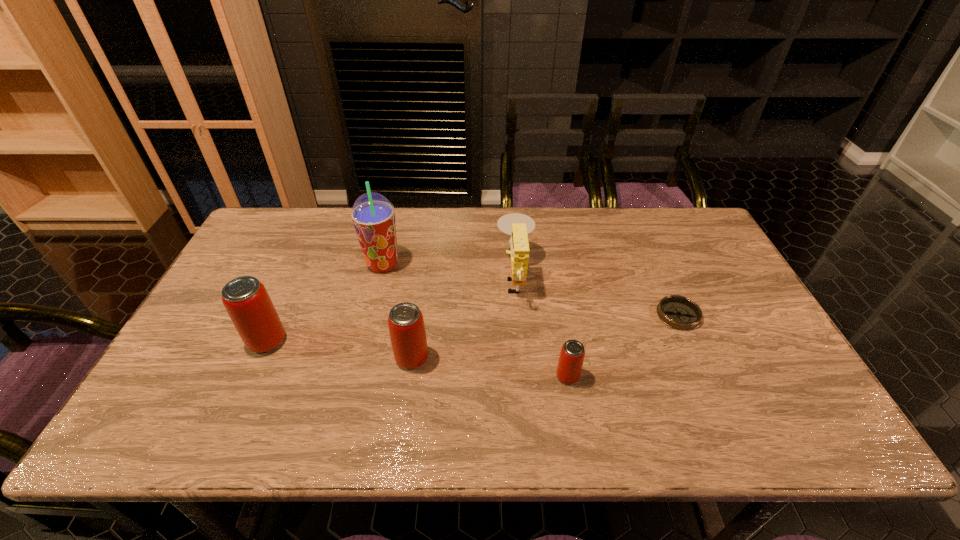
This screenshot has height=540, width=960. Identify the location of vacant space in between the second object from left to right and the leftmost beer can. (324, 302).

What are the coordinates of `vacant area that lies between the sponge and the compass` in the screenshot? It's located at (597, 296).

Locate an element on the screen. The height and width of the screenshot is (540, 960). vacant region between the rightmost object and the second beer can from left to right is located at coordinates (545, 336).

Where is `object that is the second nearest to the second beer can from right to left`? Image resolution: width=960 pixels, height=540 pixels. object that is the second nearest to the second beer can from right to left is located at coordinates (373, 216).

Locate an element on the screen. Image resolution: width=960 pixels, height=540 pixels. object that is the third nearest to the shortest beer can is located at coordinates (406, 325).

Identify which beer can is located as the nearest to the leftmost object. Please provide its 2D coordinates. Your answer should be formatted as a tuple, i.e. [(x, y)], where the tuple contains the x and y coordinates of a point satisfying the conditions above.

[(406, 325)]

What are the coordinates of `the second closest beer can relative to the leftmost beer can` in the screenshot? It's located at (571, 358).

I want to click on free space that satisfies the following two spatial constraints: 1. on the front-facing side of the sponge; 2. on the back side of the shortest beer can, so click(524, 376).